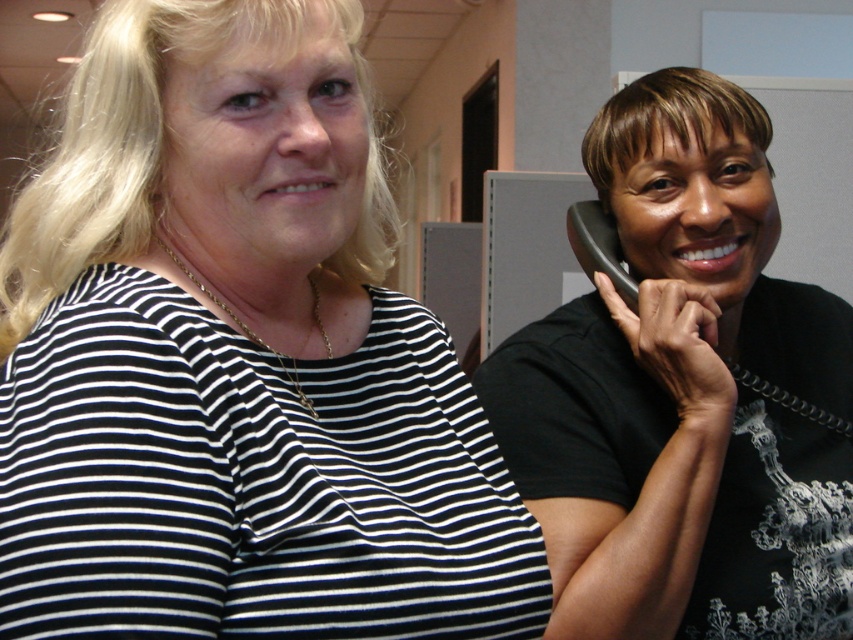
You are standing in an office and see two points marked in the image. The first point is at coordinates point (317,35) and the second point is at point (682,355). Which of these points is nearer to you?

Point (317,35) is closer to the viewer than point (682,355).

You are a delivery person who needs to place a small package between the black striped shirt at upper left and the black rubber phone at right. Can you fit the package, which is 12 inches long, in that space?

The distance between the black striped shirt at upper left and the black rubber phone at right is 14.26 inches, so the 12 inch package can fit in the space between them.

You are a delivery person who needs to place a package between the two phones. The package is 5 inches wide. Can you fit the package between the black matte phone at right and the black rubber phone at right?

The distance between the black matte phone at right and the black rubber phone at right is 6.19 inches. Since the package is 5 inches wide, it can fit between them as there is enough space.